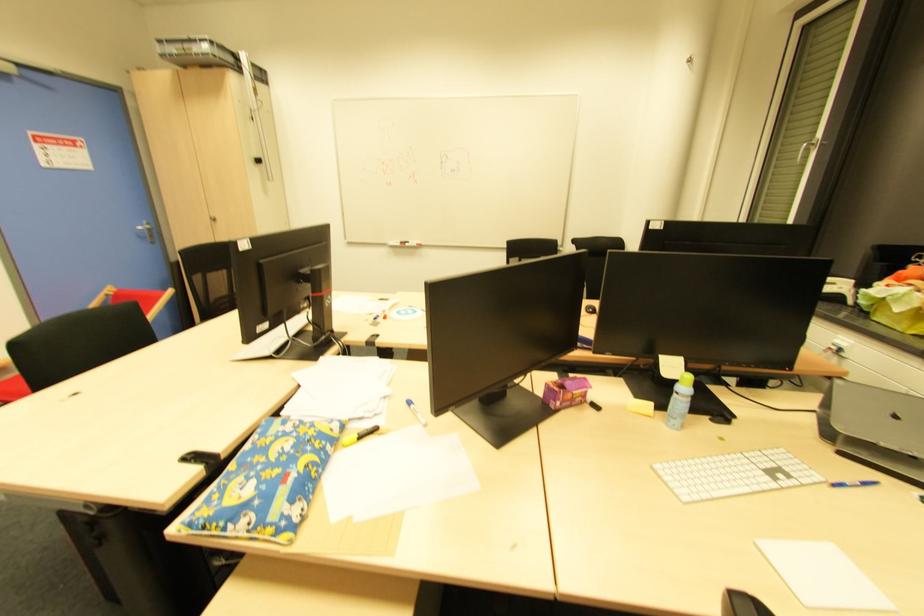
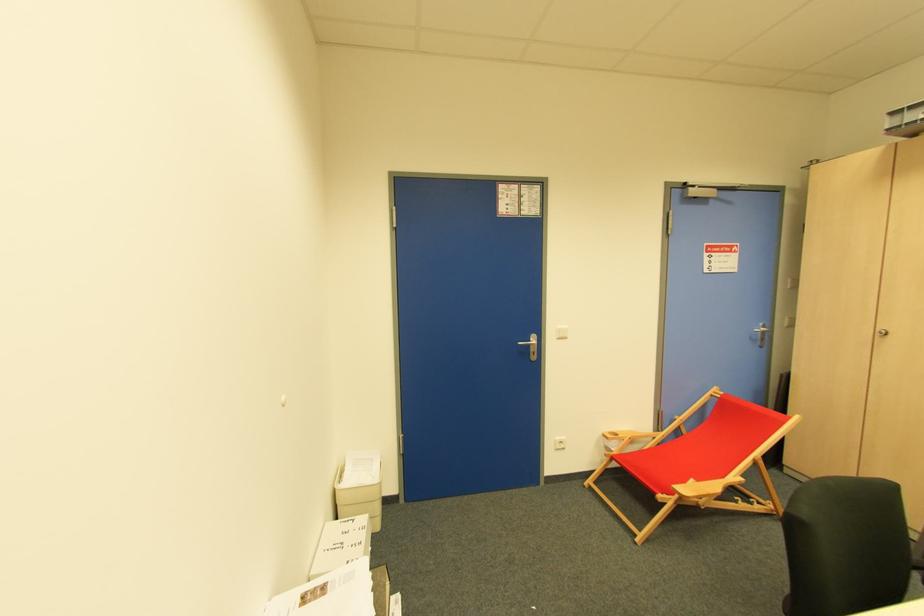
Find the pixel in the second image that matches (x=151, y=231) in the first image.

(763, 333)